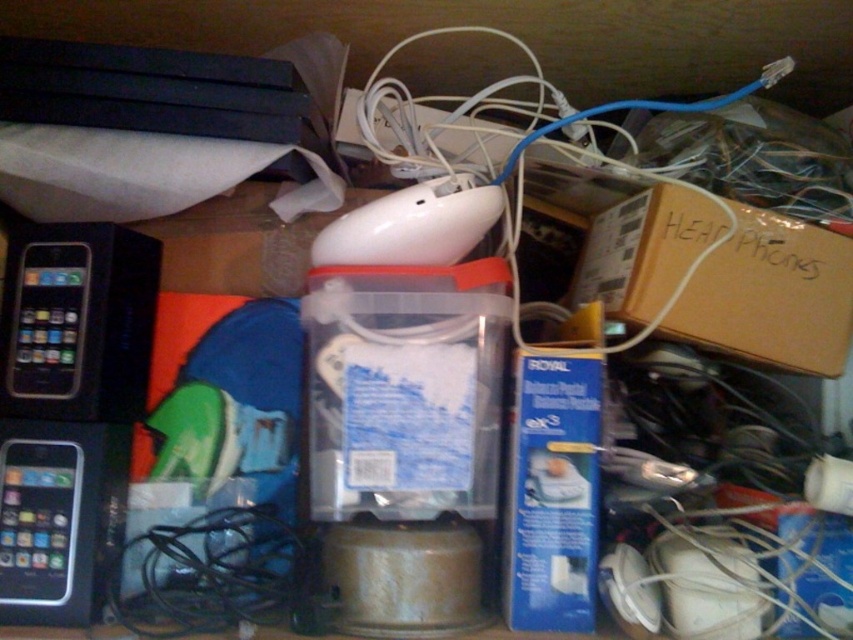
Question: Based on their relative distances, which object is farther from the black glossy ipod at left?

Choices:
 (A) blue cable at center
 (B) black glossy ipod at lower left
 (C) black glossy iphone at left

Answer: (A)

Question: Can you confirm if blue cable at center is wider than black glossy ipod at lower left?

Choices:
 (A) no
 (B) yes

Answer: (B)

Question: Which point is closer to the camera taking this photo?

Choices:
 (A) (514, 218)
 (B) (103, 403)
 (C) (62, 301)
 (D) (56, 497)

Answer: (D)

Question: Which point is farther from the camera taking this photo?

Choices:
 (A) [x=19, y=376]
 (B) [x=149, y=349]

Answer: (B)

Question: Can you confirm if black glossy iphone at left is positioned below blue cable at center?

Choices:
 (A) no
 (B) yes

Answer: (B)

Question: Does blue cable at center appear over black glossy ipod at left?

Choices:
 (A) no
 (B) yes

Answer: (B)